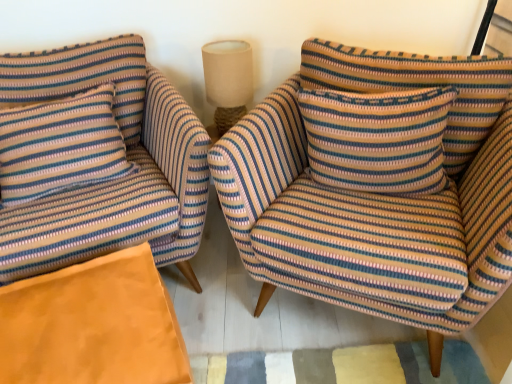
Find the location of a particular element. empty space that is ontop of orange suede ottoman at lower left (from a real-world perspective) is located at coordinates pos(79,321).